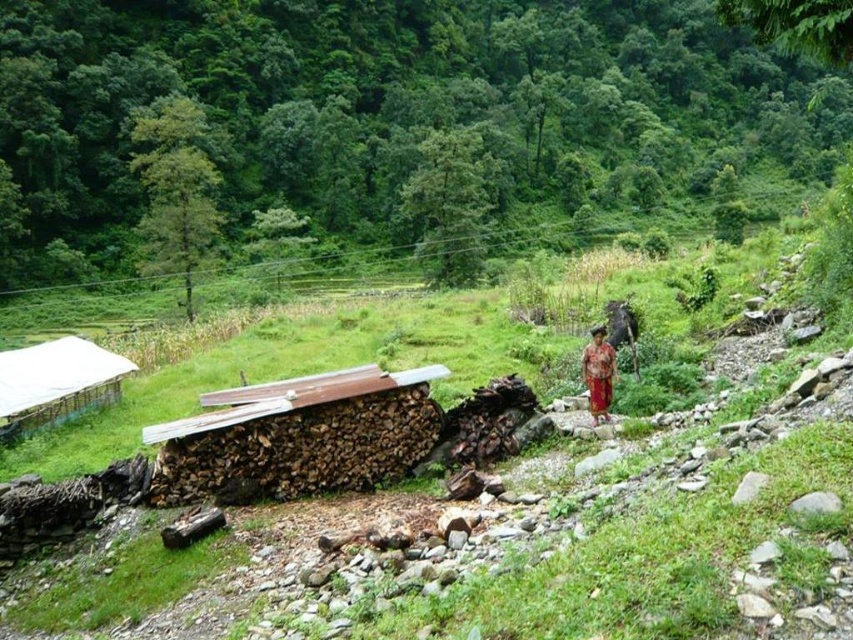
Question: Which point is closer to the camera?

Choices:
 (A) white plastic hut at lower left
 (B) red fabric dress at center

Answer: (B)

Question: Which of the following is the closest to the observer?

Choices:
 (A) red fabric dress at center
 (B) white plastic hut at lower left

Answer: (A)

Question: From the image, what is the correct spatial relationship of white plastic hut at lower left in relation to red fabric dress at center?

Choices:
 (A) left
 (B) right

Answer: (A)

Question: Which point is farther to the camera?

Choices:
 (A) (585, 355)
 (B) (51, 381)

Answer: (B)

Question: Does white plastic hut at lower left have a greater width compared to red fabric dress at center?

Choices:
 (A) yes
 (B) no

Answer: (A)

Question: Does white plastic hut at lower left come behind red fabric dress at center?

Choices:
 (A) yes
 (B) no

Answer: (A)